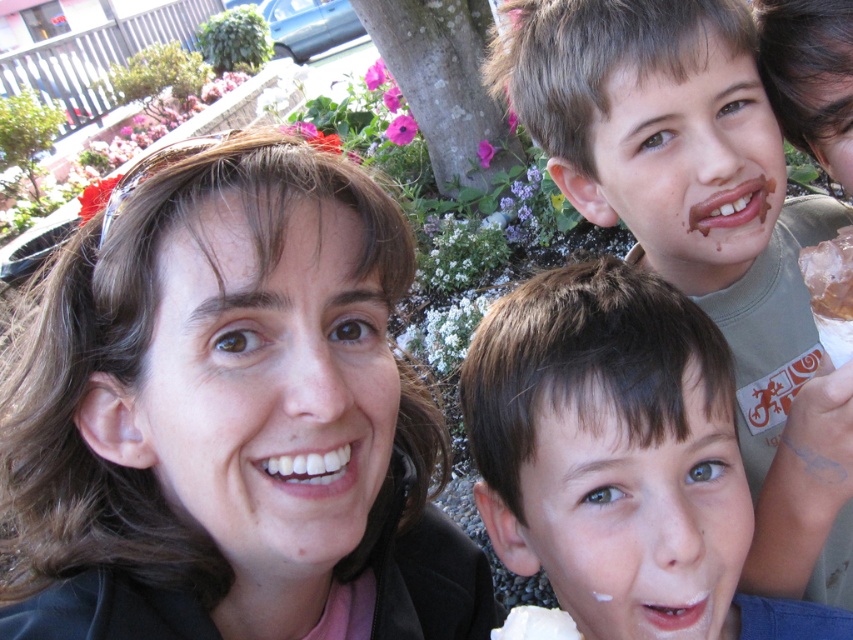
Question: Does brown hair boy at center appear over chocolate ice cream at right?

Choices:
 (A) yes
 (B) no

Answer: (B)

Question: Estimate the real-world distances between objects in this image. Which object is closer to the white creamy ice cream at lower center?

Choices:
 (A) brown hair boy at center
 (B) black leather jacket at center
 (C) chocolate ice cream at right

Answer: (A)

Question: Does black leather jacket at center have a greater width compared to white creamy ice cream at lower center?

Choices:
 (A) yes
 (B) no

Answer: (A)

Question: Which is farther from the white creamy ice cream at lower center?

Choices:
 (A) black leather jacket at center
 (B) chocolate ice cream at right

Answer: (B)

Question: Is brown hair boy at center above chocolate ice cream at right?

Choices:
 (A) yes
 (B) no

Answer: (B)

Question: Among these points, which one is nearest to the camera?

Choices:
 (A) (131, 294)
 (B) (848, 272)

Answer: (A)